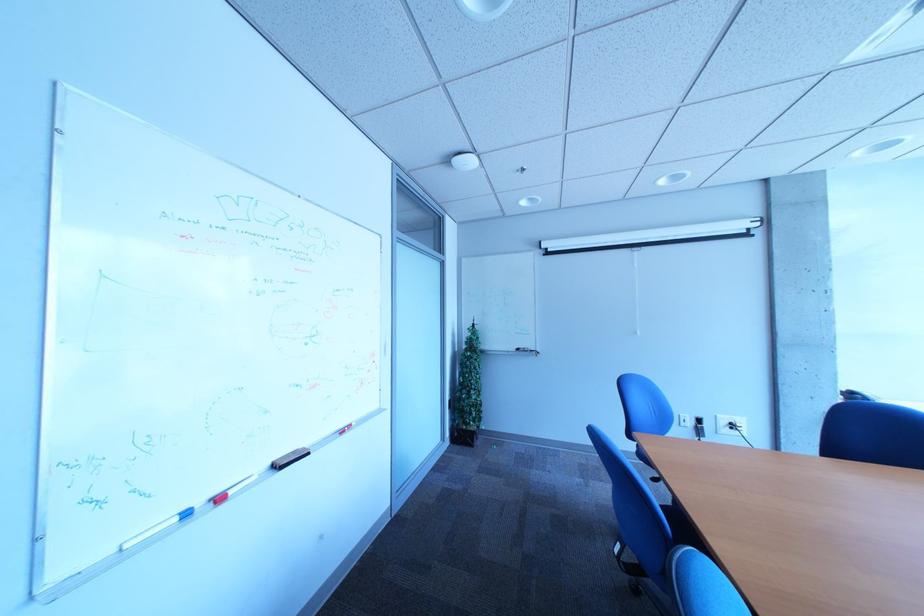
Identify the location of projector screen handle. This screenshot has width=924, height=616. (636, 288).